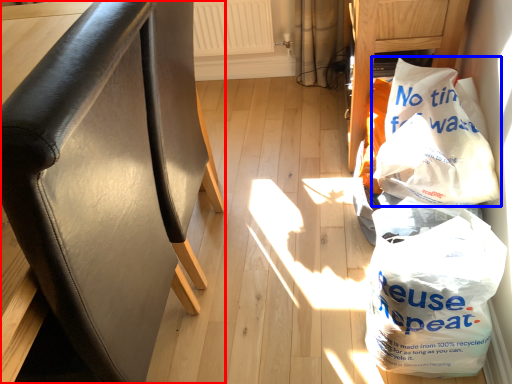
Question: Which object is closer to the camera taking this photo, furniture (highlighted by a red box) or plastic bag (highlighted by a blue box)?

Choices:
 (A) furniture
 (B) plastic bag

Answer: (A)